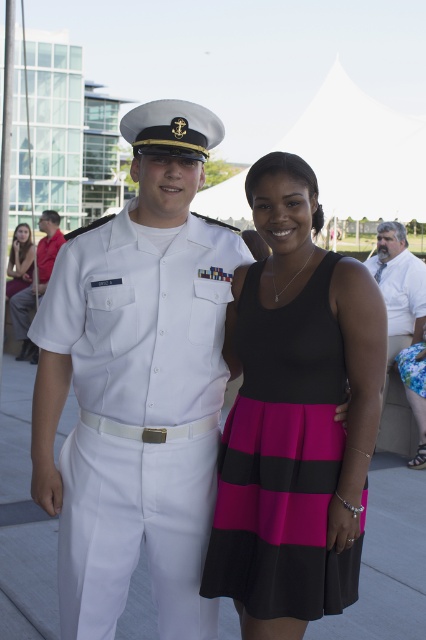
You are a photographer at the event and want to take a photo of both the man and the woman. The man is standing at point (316, 269) and the woman is at point (36, 353). To ensure both are fully visible in the frame, should you position yourself closer to the man or the woman?

You should position yourself closer to the woman at point (36, 353) because point (316, 269) is in front of point (36, 353). This way, the man will be closer to the camera, ensuring both subjects are fully visible without one blocking the other.

You are a photographer at the event. You need to place a spotlight exactly at point (282, 460). What object should you illuminate with the spotlight?

The black matte dress at center is located at point (282, 460), so you should illuminate the black matte dress at center with the spotlight.

You are standing in front of the man in the white naval uniform and the woman in the sleeveless black dress. There are two points marked on the image at coordinates point (327,275) and point (28,275). Which of these points is closer to you?

Point (327,275) is closer to the viewer than point (28,275).